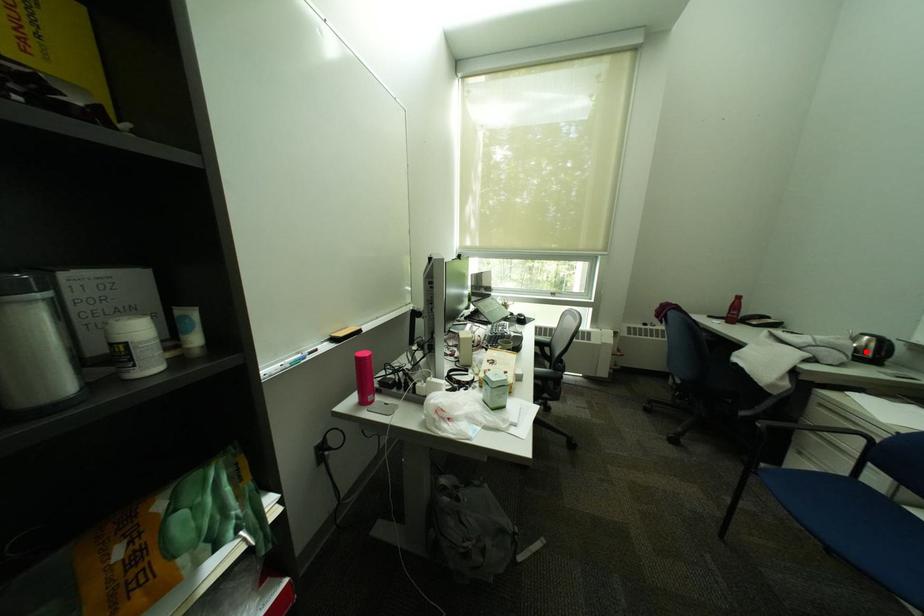
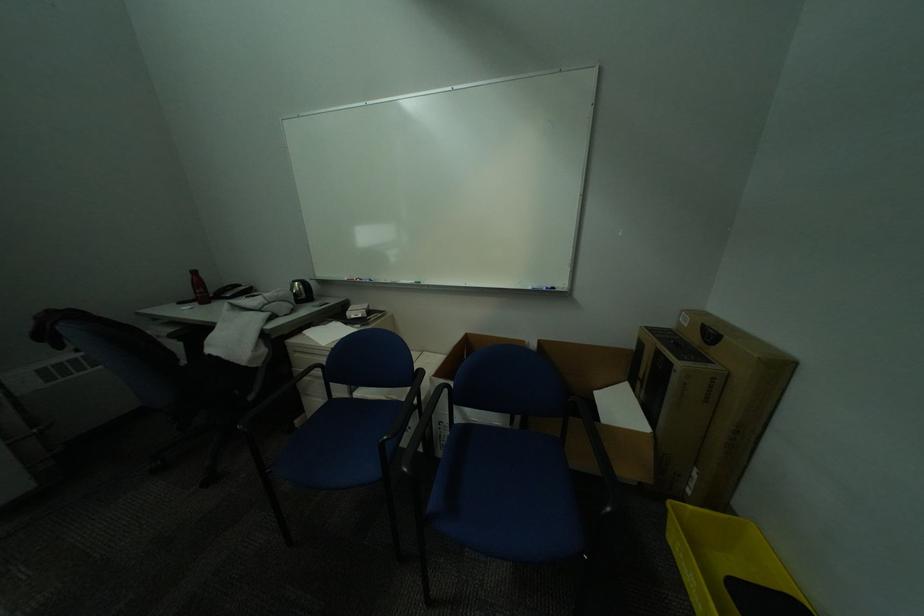
Question: I am providing you with two images of the same scene from different viewpoints. Given a red point in image1, look at the same physical point in image2. Is it:

Choices:
 (A) Closer to the viewpoint
 (B) Farther from the viewpoint

Answer: (A)